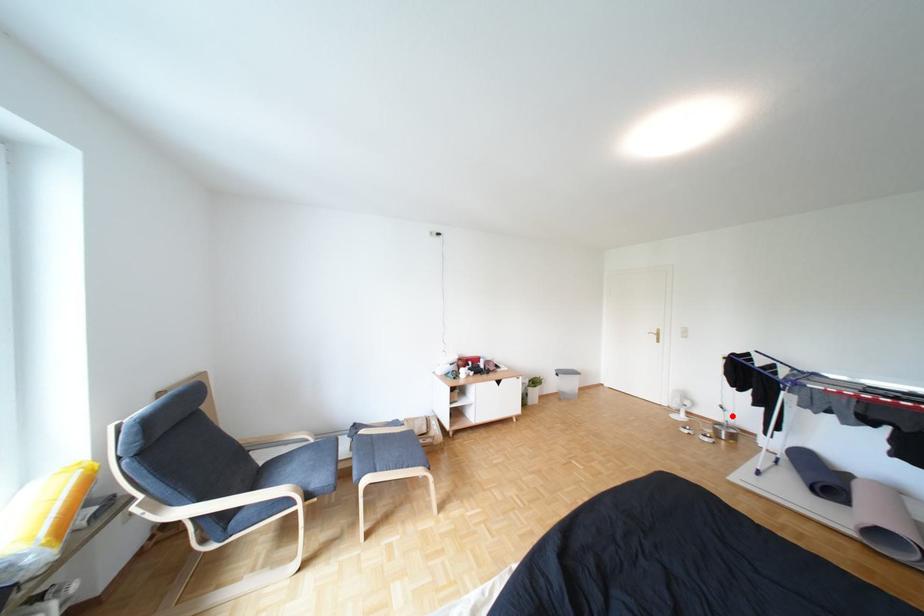
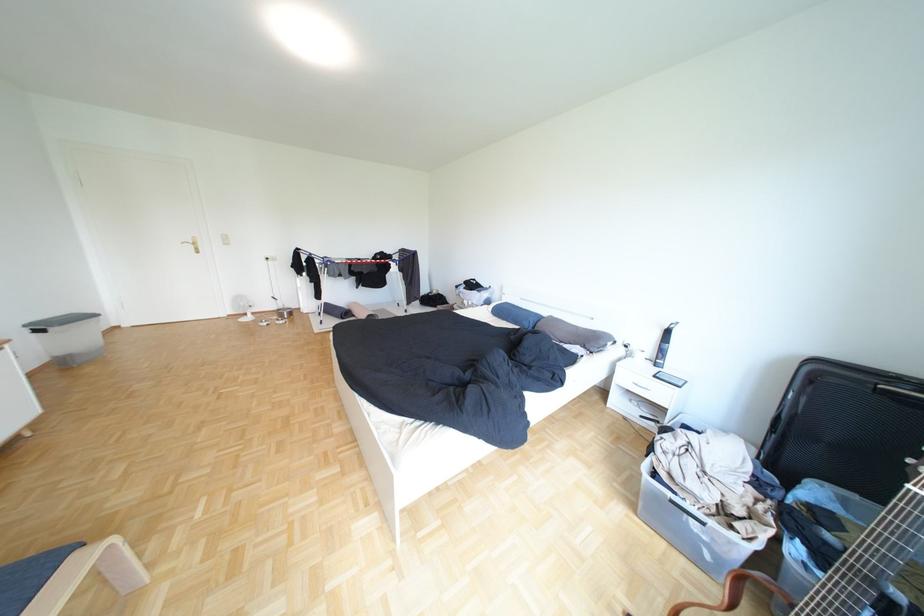
Question: A red point is marked in image1. In image2, is the corresponding 3D point closer to the camera or farther? Reply with the corresponding letter.

Choices:
 (A) The corresponding 3D point is closer.
 (B) The corresponding 3D point is farther.

Answer: (B)